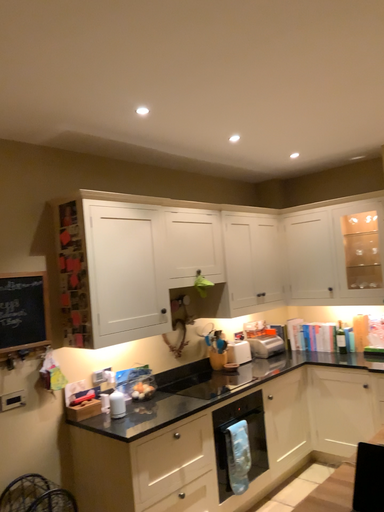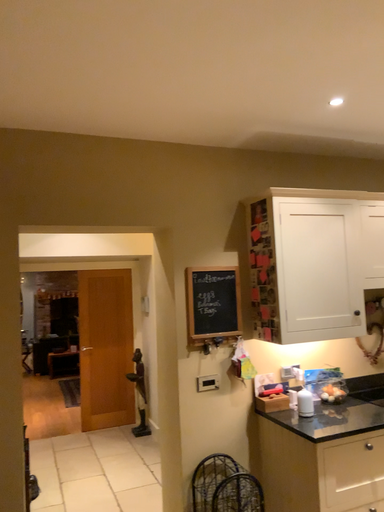
Question: Which way did the camera rotate in the video?

Choices:
 (A) rotated right
 (B) rotated left

Answer: (B)